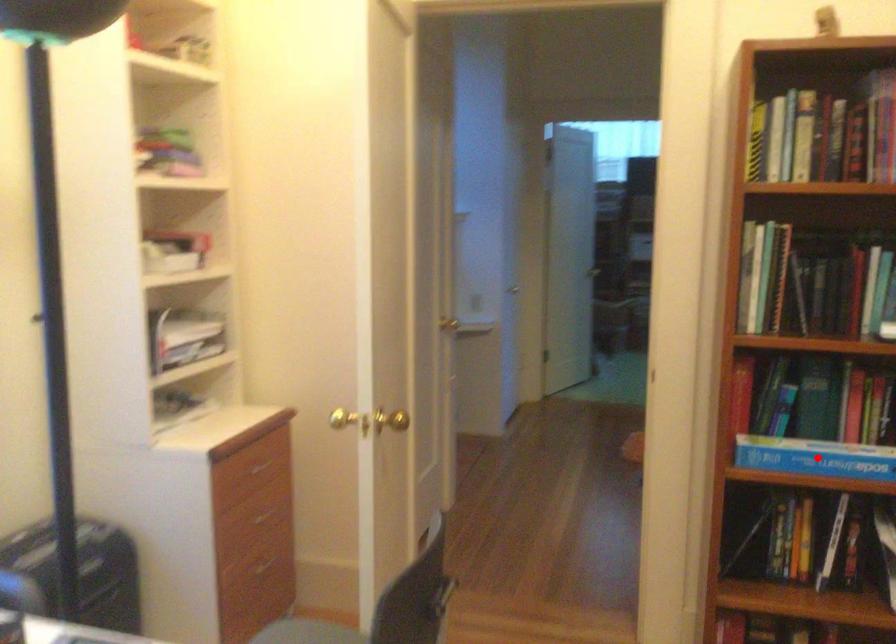
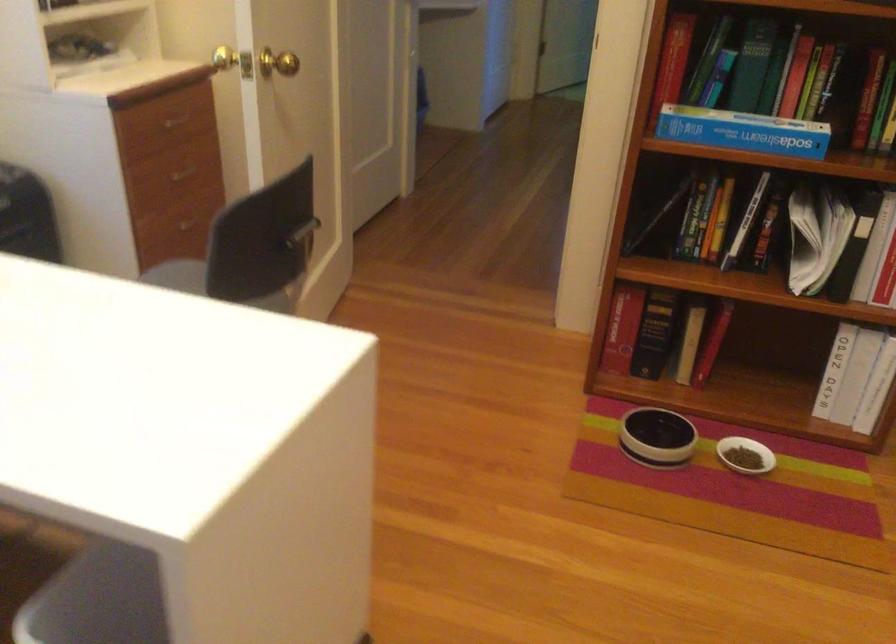
In the second image, find the point that corresponds to the highlighted location in the first image.

(743, 131)